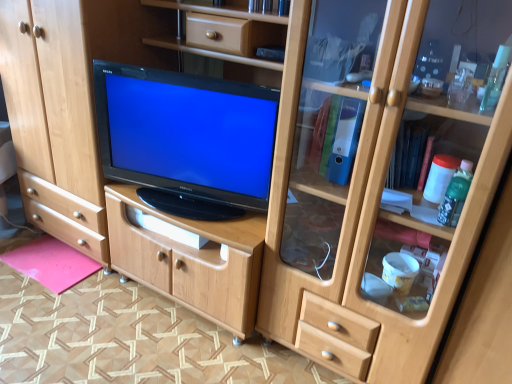
Identify the location of empty space that is ontop of pink matte mat at lower left (from a real-world perspective). (52, 260).